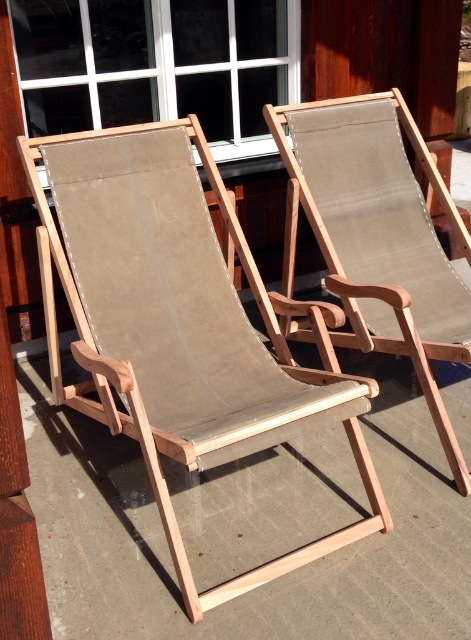
Which is more to the right, natural wood beach chair at center or matte brown fabric chair at center?

Positioned to the right is matte brown fabric chair at center.

Is point (81, 387) positioned behind point (333, 148)?

No.

Image resolution: width=471 pixels, height=640 pixels. What do you see at coordinates (178, 324) in the screenshot?
I see `natural wood beach chair at center` at bounding box center [178, 324].

Identify the location of natural wood beach chair at center. Image resolution: width=471 pixels, height=640 pixels. (178, 324).